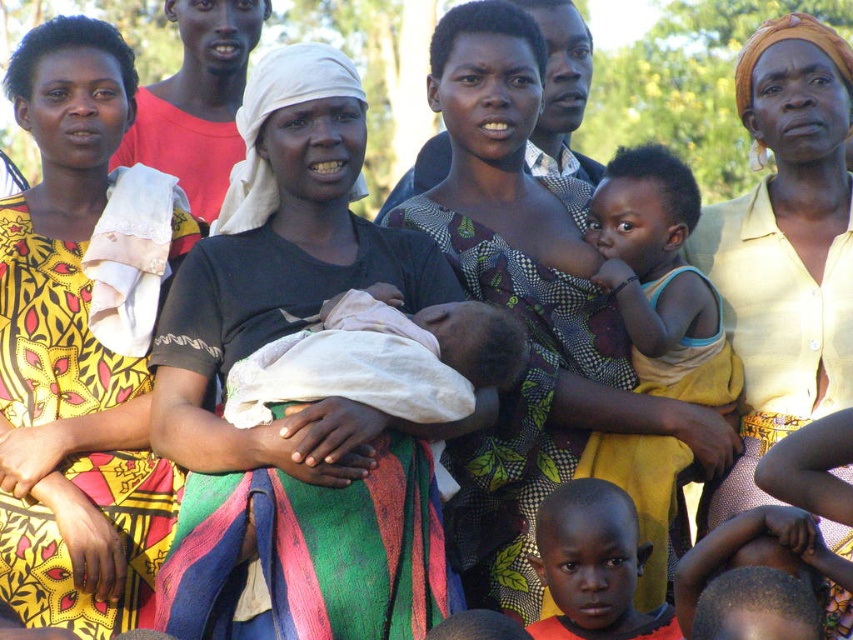
Question: Is yellow printed fabric at left below yellow cotton shirt at center?

Choices:
 (A) no
 (B) yes

Answer: (B)

Question: Considering the relative positions of yellow printed fabric at left and orange fabric baby at center in the image provided, where is yellow printed fabric at left located with respect to orange fabric baby at center?

Choices:
 (A) above
 (B) below

Answer: (A)

Question: Which of the following is the farthest from the observer?

Choices:
 (A) matte black shirt at center
 (B) yellow cotton shirt at center
 (C) light blue cotton shirt at center
 (D) printed fabric baby at center

Answer: (B)

Question: Is yellow printed fabric at left smaller than yellow cotton shirt at center?

Choices:
 (A) yes
 (B) no

Answer: (A)

Question: Among these objects, which one is farthest from the camera?

Choices:
 (A) printed fabric baby at center
 (B) light blue cotton shirt at center
 (C) orange fabric baby at center
 (D) yellow cotton shirt at center

Answer: (D)

Question: Which point is closer to the camera taking this photo?

Choices:
 (A) (780, 378)
 (B) (515, 269)

Answer: (B)